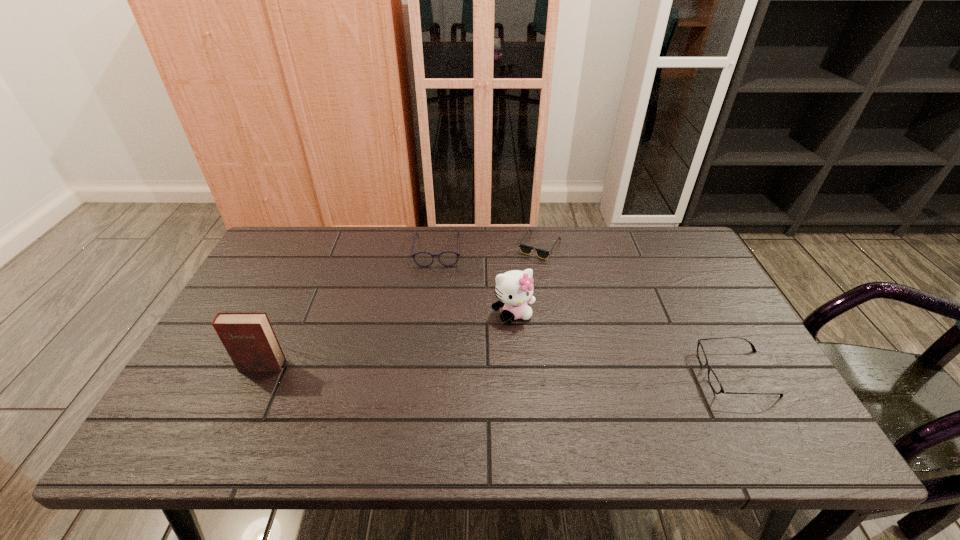
This screenshot has height=540, width=960. What are the coordinates of `vacant space located on the front-facing side of the rightmost object` in the screenshot? It's located at (579, 374).

The image size is (960, 540). I want to click on free space located 0.260m on the front-facing side of the rightmost object, so click(595, 374).

This screenshot has height=540, width=960. I want to click on blank area located 0.340m on the front-facing side of the taller spectacles, so click(432, 353).

The height and width of the screenshot is (540, 960). In order to click on free location located 0.180m on the front-facing side of the taller spectacles in this screenshot , I will do `click(435, 308)`.

Locate an element on the screen. This screenshot has width=960, height=540. vacant area located on the front-facing side of the taller spectacles is located at coordinates tap(436, 280).

The height and width of the screenshot is (540, 960). I want to click on free spot located 0.130m on the front-facing side of the kitten, so click(x=538, y=362).

The image size is (960, 540). Identify the location of vacant space located on the front-facing side of the kitten. (561, 410).

Image resolution: width=960 pixels, height=540 pixels. I want to click on free spot located 0.160m on the front-facing side of the kitten, so click(542, 372).

At what (x,y) coordinates should I click in order to perform the action: click on vacant area situated on the lenses of the sunglasses. Please return your answer as a coordinate pair (x, y). The image size is (960, 540). Looking at the image, I should click on (562, 350).

Where is `free location located on the lenses of the sunglasses`? free location located on the lenses of the sunglasses is located at coordinates (545, 272).